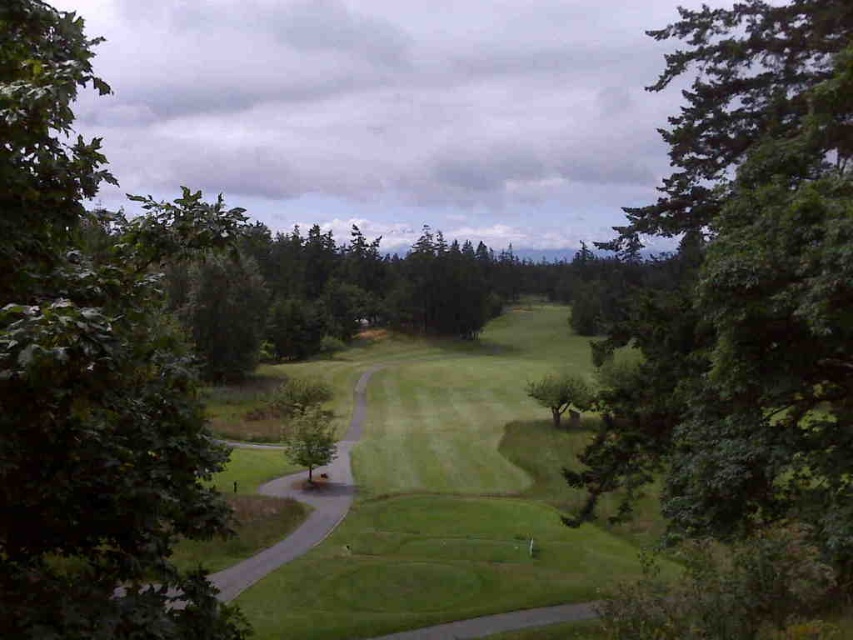
Does green leafy tree at left have a smaller size compared to green grassy path at center?

No.

Is point (129, 241) more distant than point (368, 371)?

That is False.

You are a GUI agent. You are given a task and a screenshot of the screen. Output one action in this format:
    pyautogui.click(x=<x>, y=<y>)
    Task: Click on the green leafy tree at left
    The image size is (853, 640).
    Given the screenshot: What is the action you would take?
    pyautogui.click(x=93, y=371)

Who is more distant from viewer, [788,275] or [535,388]?

The point [535,388] is more distant.

Does point (686, 16) come behind point (555, 408)?

That is False.

The height and width of the screenshot is (640, 853). Find the location of `green leafy tree at right`. green leafy tree at right is located at coordinates (744, 326).

Is point (843, 22) less distant than point (271, 556)?

Yes, point (843, 22) is in front of point (271, 556).

Who is more distant from viewer, (848, 522) or (573, 531)?

The point (573, 531) is behind.

Identify the location of green leafy tree at right. (744, 326).